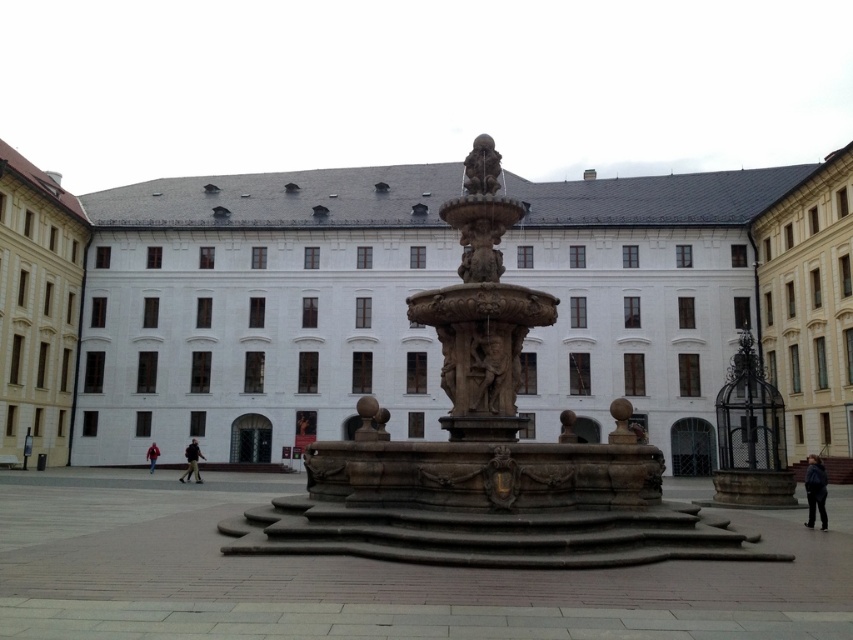
Question: Does polished stone statue at center come behind polished stone sculpture at center?

Choices:
 (A) no
 (B) yes

Answer: (A)

Question: Which point is farther from the camera taking this photo?

Choices:
 (A) (810, 456)
 (B) (486, 150)
 (C) (187, 476)
 (D) (38, 388)

Answer: (D)

Question: Which object is closer to the camera taking this photo?

Choices:
 (A) brown stone fountain at center
 (B) dark blue jacket at lower right

Answer: (A)

Question: Which of these objects is positioned farthest from the stone fountain at center?

Choices:
 (A) white stone building at left
 (B) black fabric person at center
 (C) dark blue jacket at lower right

Answer: (A)

Question: Can you confirm if white stone building at left is smaller than dark blue jacket at lower right?

Choices:
 (A) yes
 (B) no

Answer: (B)

Question: Is polished stone statue at center wider than dark blue jacket at lower right?

Choices:
 (A) no
 (B) yes

Answer: (A)